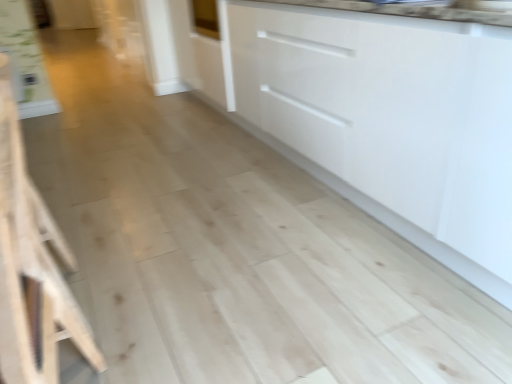
Find the location of a particular element. The height and width of the screenshot is (384, 512). free space to the back side of light wood stool at left is located at coordinates (113, 257).